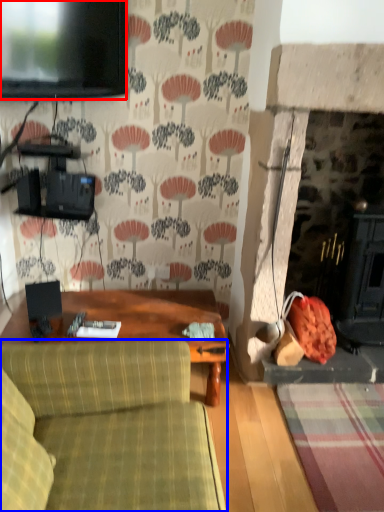
Question: Which of the following is the farthest to the observer, television (highlighted by a red box) or studio couch (highlighted by a blue box)?

Choices:
 (A) television
 (B) studio couch

Answer: (A)